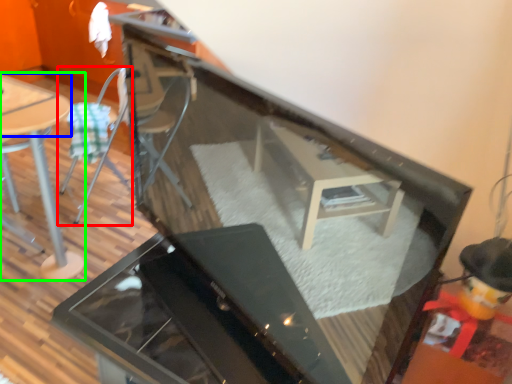
Question: Which object is the closest to the chair (highlighted by a red box)? Choose among these: table top (highlighted by a blue box) or table (highlighted by a green box).

Choices:
 (A) table top
 (B) table

Answer: (A)